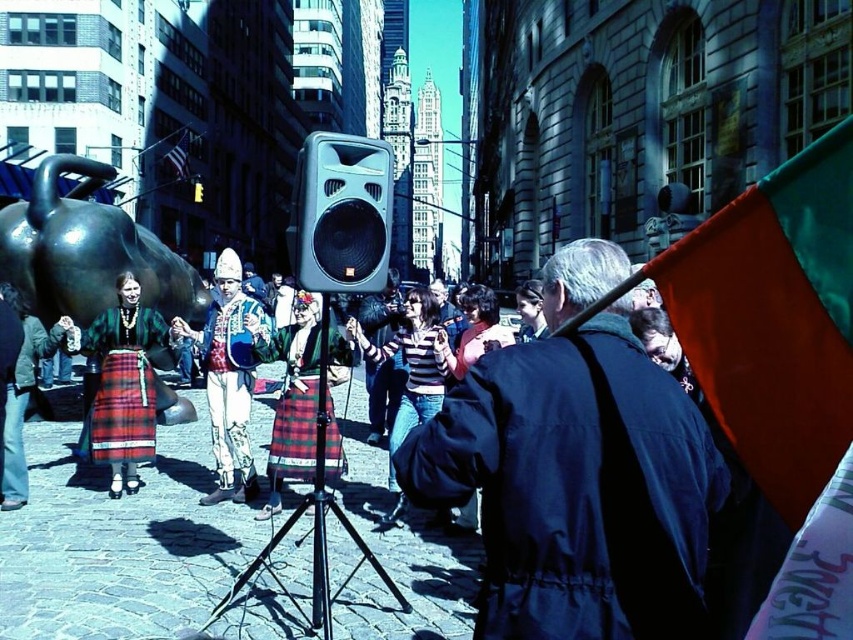
You are a photographer at the event and want to capture both the orange fabric flag at center right and the green fabric flag at upper right in a single shot. Which flag should you focus on first to ensure both are in frame?

The orange fabric flag at center right is positioned over the green fabric flag at upper right, so focusing on the orange fabric flag at center right first would ensure both are visible in the shot.

You are a photographer trying to capture both the green fabric flag at upper right and the embroidered fabric outfit at center in the same frame. Based on their heights, which object would appear smaller in your photo?

The green fabric flag at upper right has a lesser height compared to the embroidered fabric outfit at center, so it would appear smaller in the photo.

You are a photographer at the event and want to capture both the orange fabric flag at center right and the green fabric flag at upper right in a single shot. Which flag should you focus on first to ensure both are in frame?

You should focus on the orange fabric flag at center right first since it is closer to you than the green fabric flag at upper right, ensuring both flags remain in the frame.